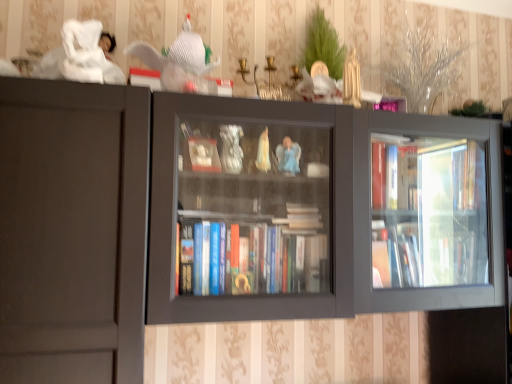
What do you see at coordinates (180, 62) in the screenshot?
I see `white matte teapot at upper left` at bounding box center [180, 62].

Measure the distance between point [201,53] and camera.

Point [201,53] is 4.64 feet away from camera.

Where is `white matte teapot at upper left`? Image resolution: width=512 pixels, height=384 pixels. white matte teapot at upper left is located at coordinates (180, 62).

Locate an element on the screen. The height and width of the screenshot is (384, 512). white matte teapot at upper left is located at coordinates (180, 62).